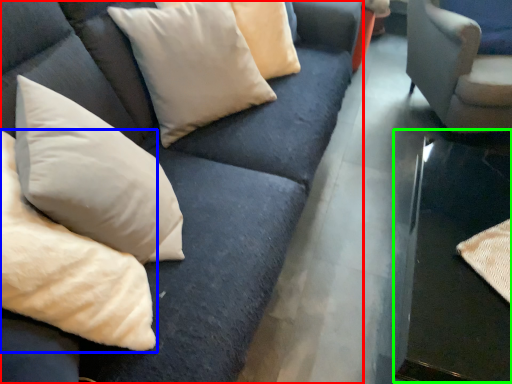
Question: Which object is positioned closest to studio couch (highlighted by a red box)? Select from pillow (highlighted by a blue box) and table (highlighted by a green box).

Choices:
 (A) pillow
 (B) table

Answer: (A)